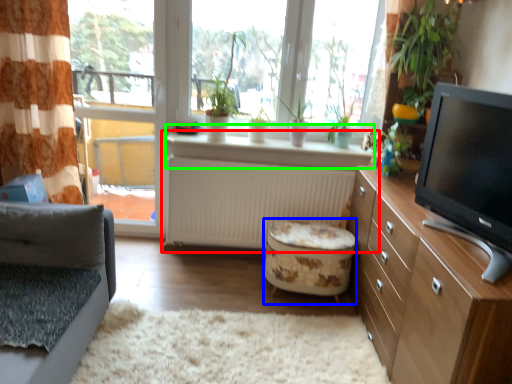
Question: Which is nearer to the desk (highlighted by a red box)? stool (highlighted by a blue box) or window sill (highlighted by a green box).

Choices:
 (A) stool
 (B) window sill

Answer: (B)